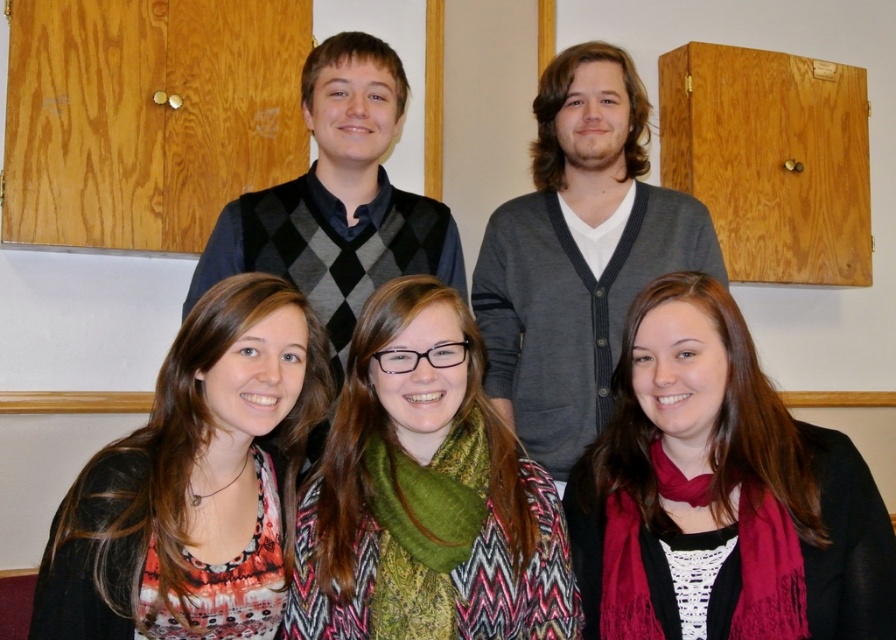
Question: Can you confirm if matte black shirt at lower left is positioned to the left of gray cardigan at upper center?

Choices:
 (A) no
 (B) yes

Answer: (B)

Question: Can you confirm if matte black shirt at lower left is positioned to the left of gray cardigan at upper center?

Choices:
 (A) no
 (B) yes

Answer: (B)

Question: Which of these objects is positioned farthest from the green knitted scarf at center?

Choices:
 (A) matte black jacket at lower right
 (B) matte black shirt at lower left

Answer: (A)

Question: Can you confirm if matte black shirt at lower left is wider than green knitted scarf at center?

Choices:
 (A) yes
 (B) no

Answer: (B)

Question: Which point is farther to the camera?

Choices:
 (A) (504, 285)
 (B) (808, 582)

Answer: (A)

Question: Which of these objects is positioned farthest from the matte black jacket at lower right?

Choices:
 (A) gray cardigan at upper center
 (B) green knitted scarf at center

Answer: (A)